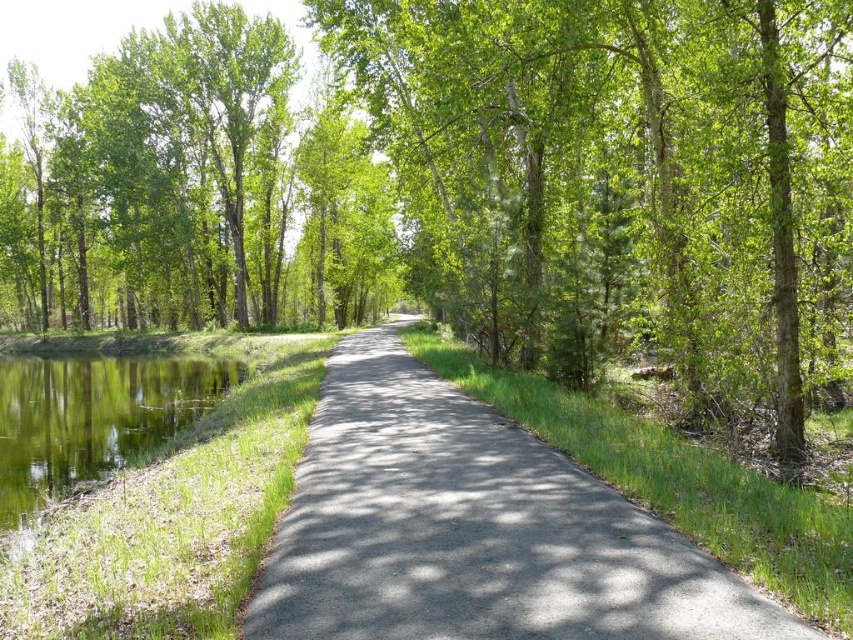
Question: Based on their relative distances, which object is farther from the green grassy water at left?

Choices:
 (A) green leafy tree at center
 (B) gray asphalt trail at center

Answer: (B)

Question: Is green leafy tree at center to the right of green grassy water at left from the viewer's perspective?

Choices:
 (A) no
 (B) yes

Answer: (B)

Question: Does gray asphalt trail at center have a lesser width compared to green grassy water at left?

Choices:
 (A) no
 (B) yes

Answer: (B)

Question: Does green leafy tree at center have a smaller size compared to gray asphalt trail at center?

Choices:
 (A) no
 (B) yes

Answer: (A)

Question: Which of the following is the farthest from the observer?

Choices:
 (A) green grassy water at left
 (B) green leafy tree at center

Answer: (A)

Question: Estimate the real-world distances between objects in this image. Which object is farther from the green grassy water at left?

Choices:
 (A) green leafy tree at center
 (B) gray asphalt trail at center

Answer: (B)